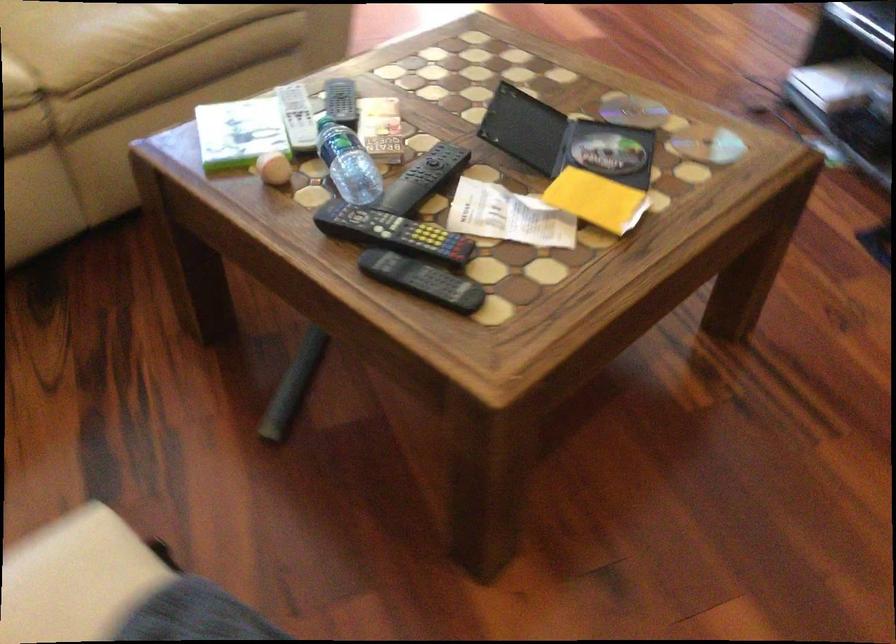
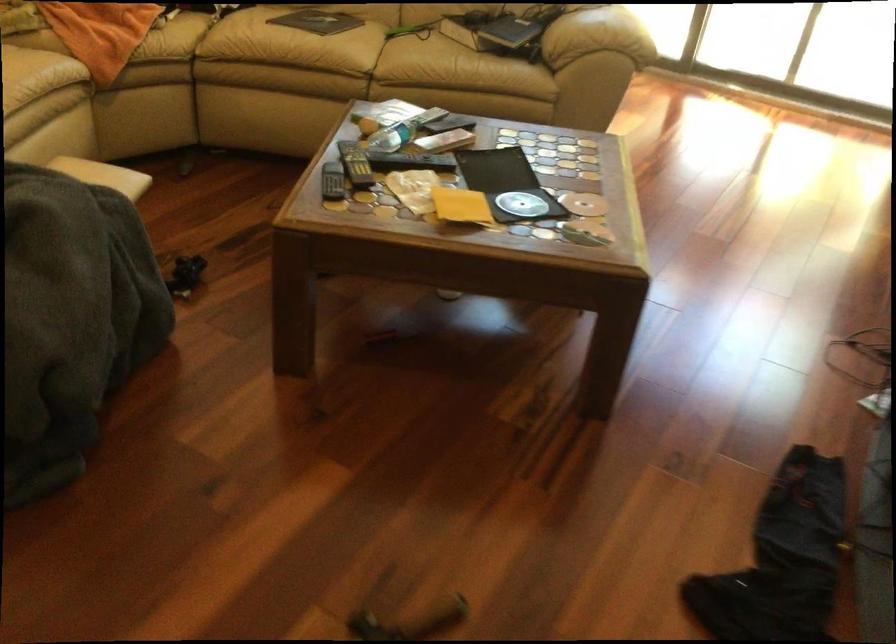
Locate, in the second image, the point that corresponds to point 416,231 in the first image.

(355, 164)